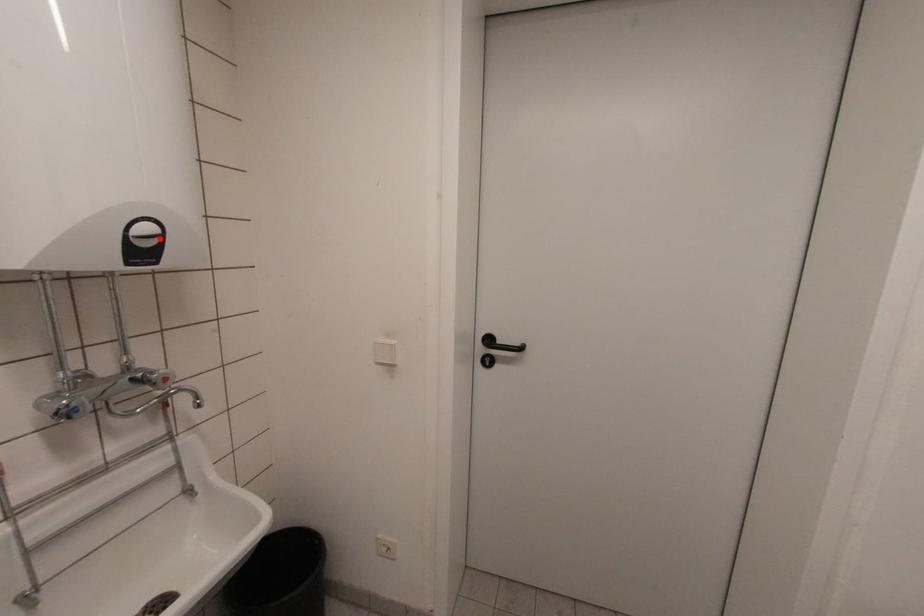
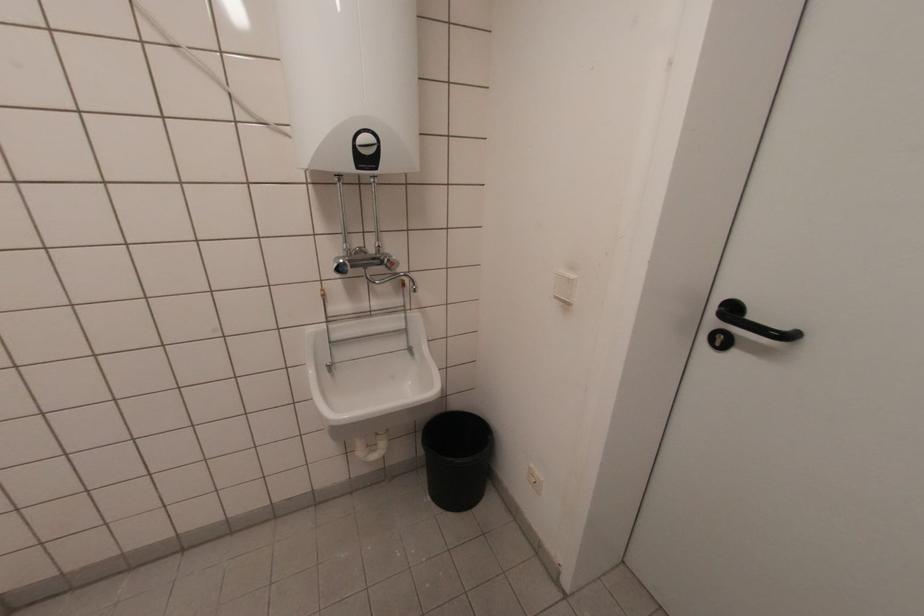
Where in the second image is the point corresponding to the highlighted location from the first image?

(377, 148)